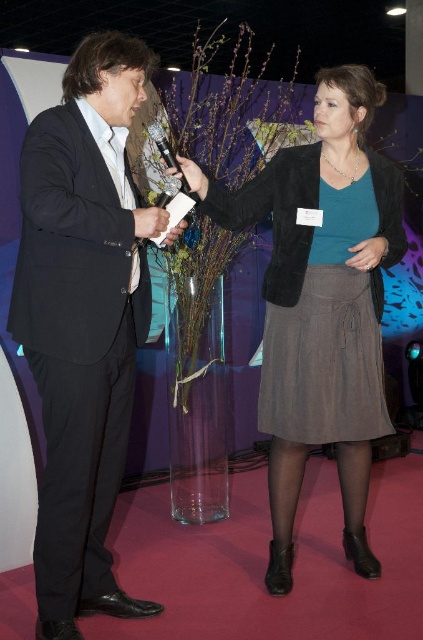
Is black matte suit at left to the right of matte black hand at center from the viewer's perspective?

In fact, black matte suit at left is to the left of matte black hand at center.

Is point (54, 356) positioned in front of point (161, 225)?

Yes, point (54, 356) is closer to viewer.

At what (x,y) coordinates should I click in order to perform the action: click on black matte suit at left. Please return your answer as a coordinate pair (x, y). Looking at the image, I should click on (82, 321).

Can you confirm if black matte suit at left is taller than matte brown skirt at center?

Yes, black matte suit at left is taller than matte brown skirt at center.

Does black matte suit at left appear on the right side of matte brown skirt at center?

In fact, black matte suit at left is to the left of matte brown skirt at center.

Which is behind, point (93, 112) or point (310, 436)?

Positioned behind is point (310, 436).

Identify the location of black matte suit at left. The image size is (423, 640). (82, 321).

Does matte brown skirt at center have a greater height compared to matte black hand at center?

Yes, matte brown skirt at center is taller than matte black hand at center.

Is matte brown skirt at center to the right of matte black hand at center from the viewer's perspective?

Yes, matte brown skirt at center is to the right of matte black hand at center.

What do you see at coordinates (320, 324) in the screenshot? This screenshot has height=640, width=423. I see `matte brown skirt at center` at bounding box center [320, 324].

You are a GUI agent. You are given a task and a screenshot of the screen. Output one action in this format:
    pyautogui.click(x=<x>, y=<y>)
    Task: Click on the matte brown skirt at center
    The height and width of the screenshot is (640, 423).
    Given the screenshot: What is the action you would take?
    pyautogui.click(x=320, y=324)